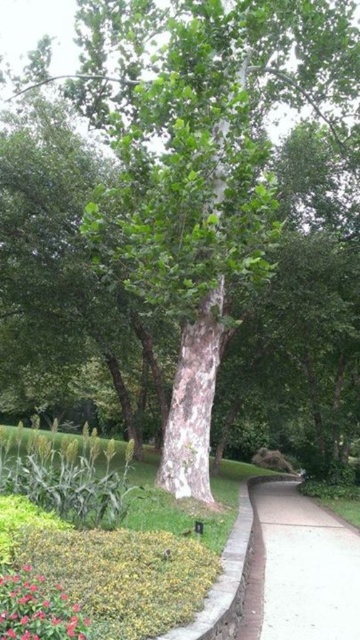
Question: Is white concrete sidewalk at lower right thinner than vivid pink petals at lower left?

Choices:
 (A) no
 (B) yes

Answer: (A)

Question: Which of the following is the closest to the observer?

Choices:
 (A) white concrete sidewalk at lower right
 (B) vivid pink petals at lower left

Answer: (B)

Question: Among these objects, which one is farthest from the camera?

Choices:
 (A) white concrete sidewalk at lower right
 (B) vivid pink petals at lower left

Answer: (A)

Question: Is white concrete sidewalk at lower right in front of vivid pink petals at lower left?

Choices:
 (A) yes
 (B) no

Answer: (B)

Question: Is white concrete sidewalk at lower right positioned at the back of vivid pink petals at lower left?

Choices:
 (A) yes
 (B) no

Answer: (A)